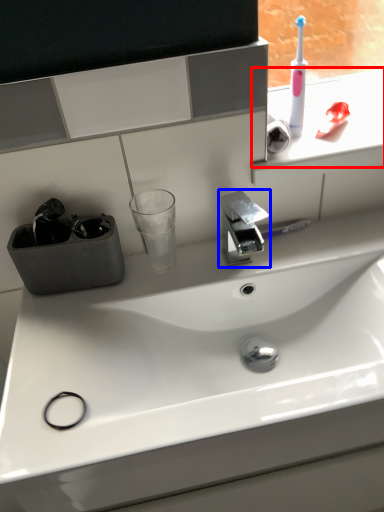
Question: Among these objects, which one is farthest to the camera, window sill (highlighted by a red box) or tap (highlighted by a blue box)?

Choices:
 (A) window sill
 (B) tap

Answer: (A)